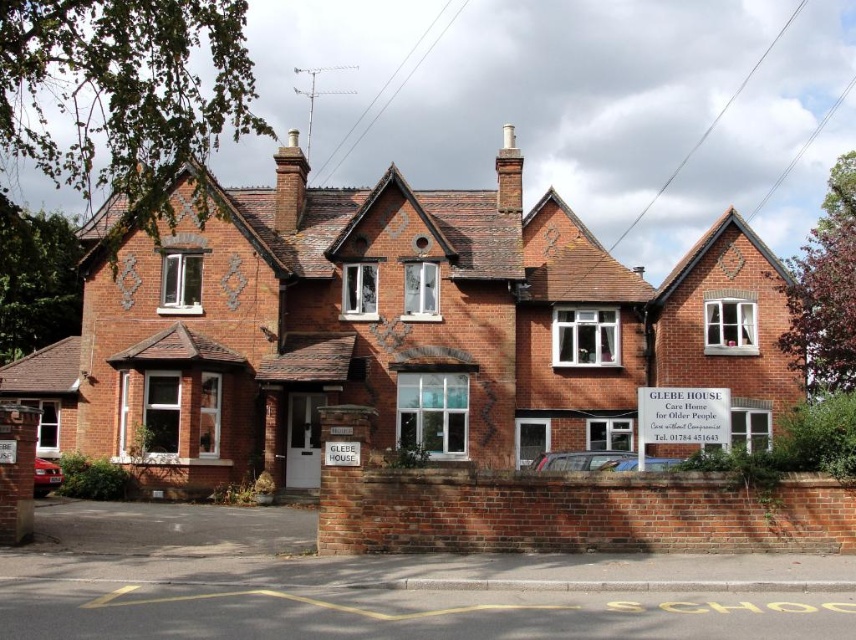
Does point (274, 218) lie in front of point (520, 186)?

Yes, point (274, 218) is closer to viewer.

Who is more distant from viewer, (280, 157) or (509, 124)?

Positioned behind is point (509, 124).

Locate an element on the screen. The height and width of the screenshot is (640, 856). brown brick chimney at upper center is located at coordinates (289, 184).